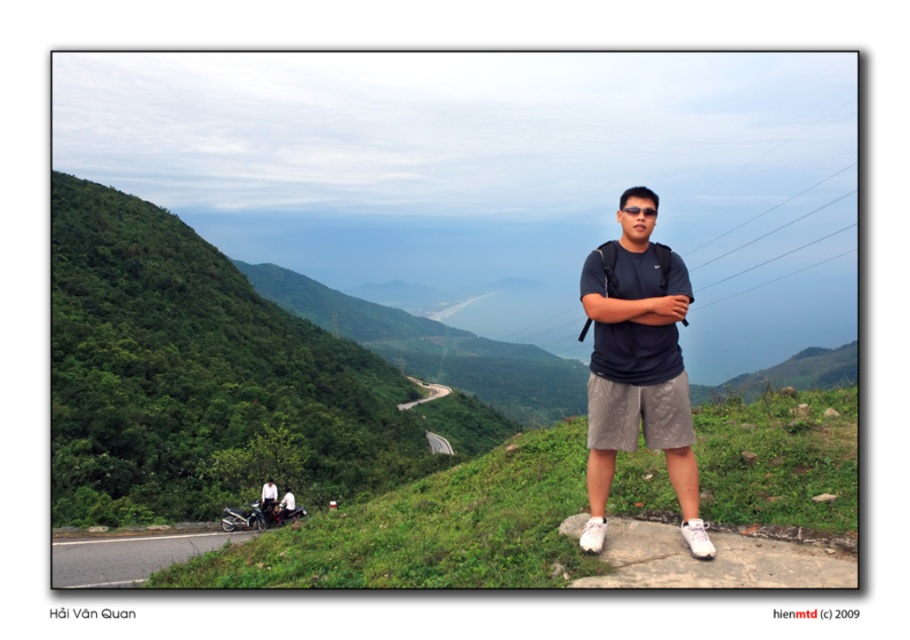
Is matte black t-shirt at center positioned behind white cotton shirt at lower left?

No, it is not.

Is point (662, 284) behind point (273, 484)?

No, (662, 284) is in front of (273, 484).

Find the location of a particular element. This screenshot has height=640, width=910. matte black t-shirt at center is located at coordinates (638, 365).